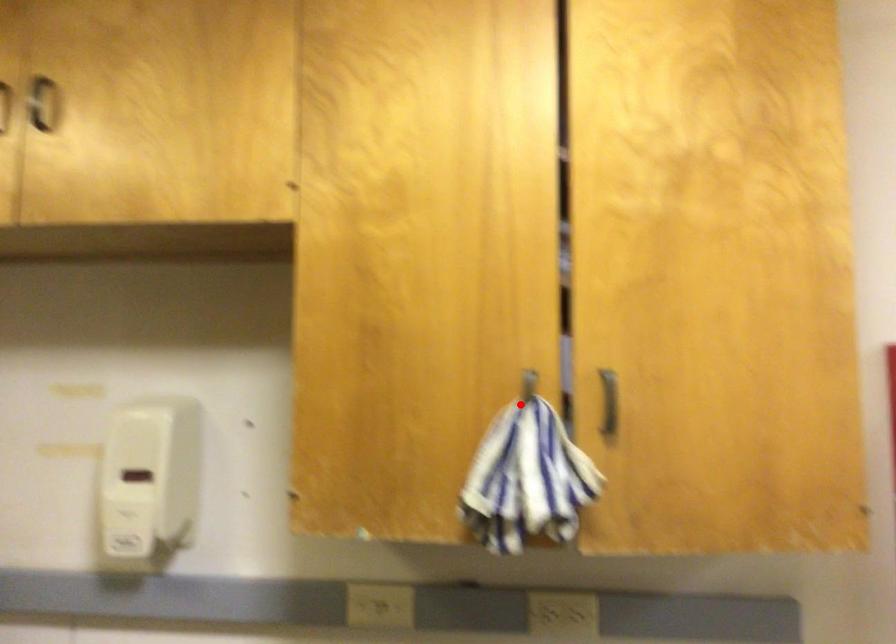
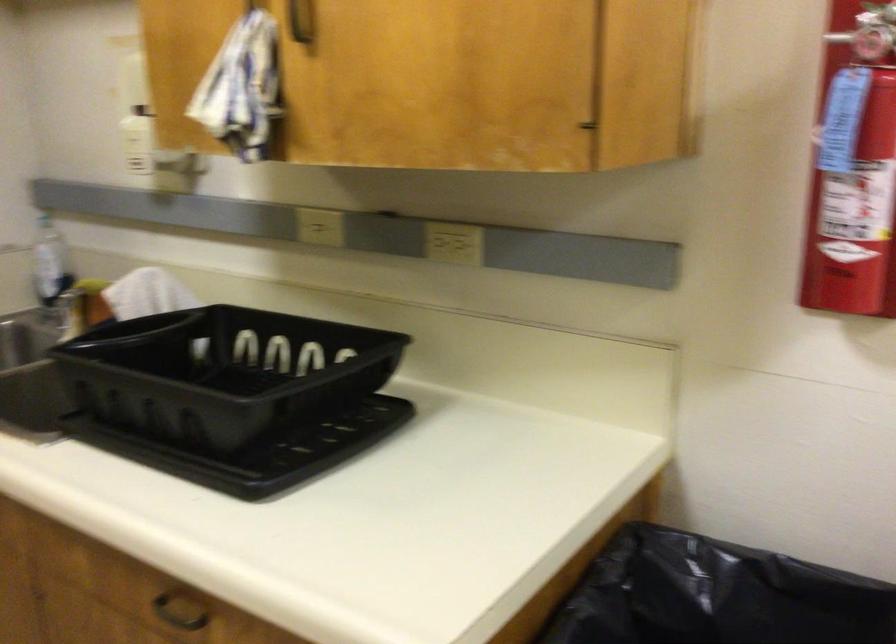
Where in the second image is the point corresponding to the highlighted location from the first image?

(251, 6)